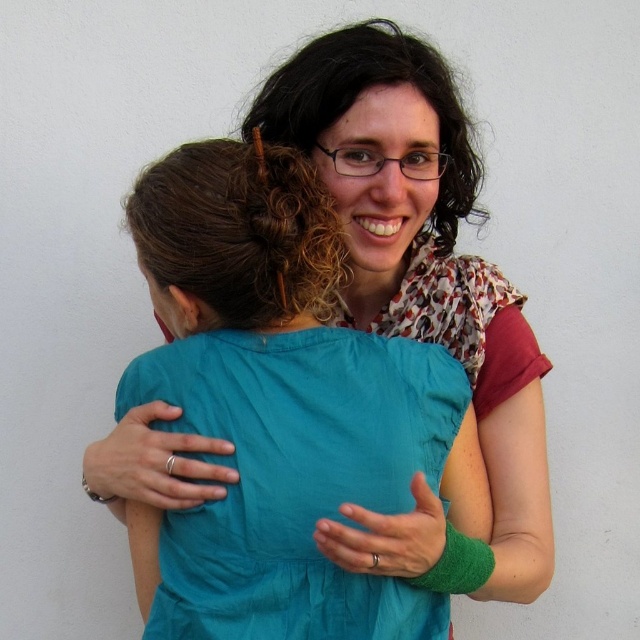
Question: Which object appears farthest from the camera in this image?

Choices:
 (A) matte teal dress at center
 (B) teal fabric dress at center

Answer: (B)

Question: Does matte teal dress at center have a larger size compared to teal fabric dress at center?

Choices:
 (A) yes
 (B) no

Answer: (A)

Question: Which point is farther to the camera?

Choices:
 (A) matte teal dress at center
 (B) teal fabric dress at center

Answer: (B)

Question: Is matte teal dress at center smaller than teal fabric dress at center?

Choices:
 (A) no
 (B) yes

Answer: (A)

Question: Which object appears closest to the camera in this image?

Choices:
 (A) teal fabric dress at center
 (B) matte teal dress at center

Answer: (B)

Question: Does matte teal dress at center appear on the left side of teal fabric dress at center?

Choices:
 (A) no
 (B) yes

Answer: (A)